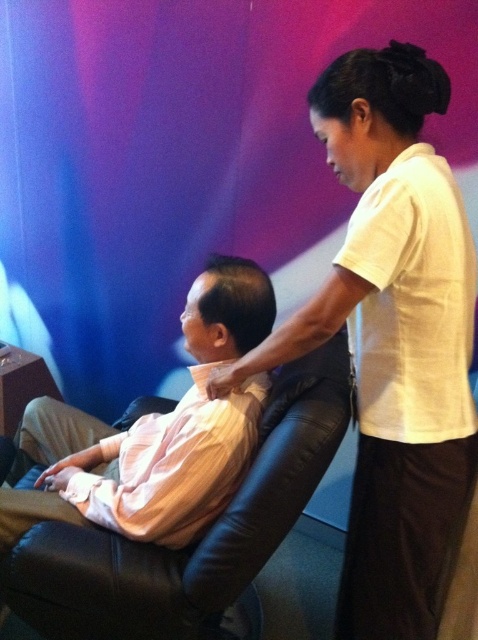
Question: Which point appears closest to the camera in this image?

Choices:
 (A) (349, 243)
 (B) (209, 614)

Answer: (A)

Question: Can you confirm if white cotton shirt at upper right is positioned to the right of black leather swivel chair at center?

Choices:
 (A) no
 (B) yes

Answer: (B)

Question: Does white cotton shirt at upper right have a smaller size compared to black leather swivel chair at center?

Choices:
 (A) no
 (B) yes

Answer: (A)

Question: Which point is farther to the camera?

Choices:
 (A) black leather swivel chair at center
 (B) white cotton shirt at upper right

Answer: (A)

Question: Which point appears farthest from the camera in this image?

Choices:
 (A) (456, 355)
 (B) (79, 636)

Answer: (B)

Question: Is white cotton shirt at upper right to the left of black leather swivel chair at center from the viewer's perspective?

Choices:
 (A) no
 (B) yes

Answer: (A)